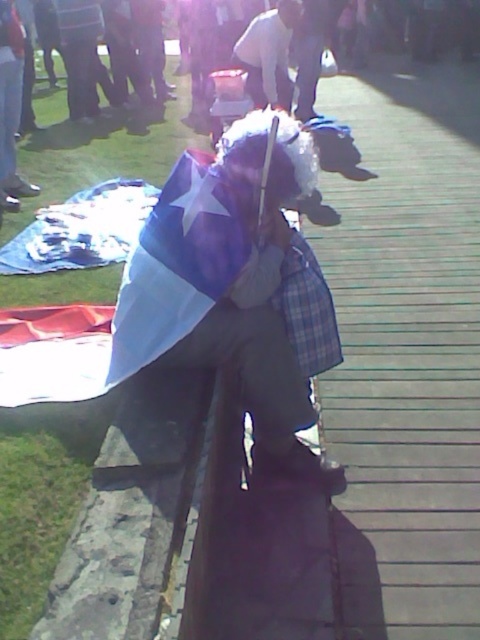
You are a photographer at the event and want to capture a clear shot of the white cotton shirt at center and the blue fabric flag at center. Which object should you focus on first to ensure both are in focus?

The blue fabric flag at center is located below the white cotton shirt at center. To ensure both are in focus, you should focus on the white cotton shirt at center first since it is closer to the camera, and the flag will be in the background. Alternatively, focusing on the midpoint between them might work better.

You are a photographer trying to capture the white fabric flag at center in your shot. What are the coordinates where you should focus your camera?

The white fabric flag at center is located at coordinates (x=145, y=291), so focus your camera there.